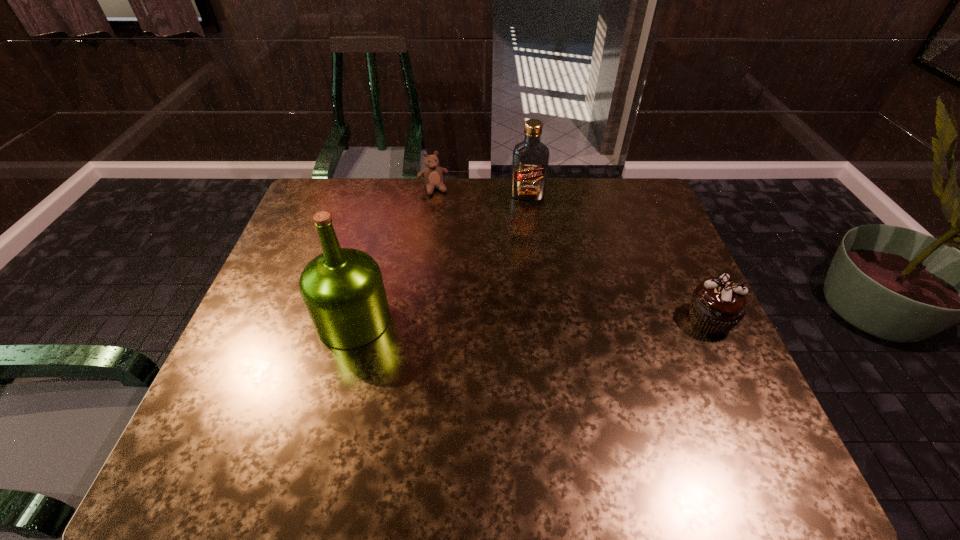
Locate an element on the screen. vacant area between the rightmost object and the tallest object is located at coordinates (532, 320).

This screenshot has width=960, height=540. I want to click on vacant region between the leftmost object and the teddy bear, so click(394, 254).

Find the location of a particular element. vacant area between the olive oil and the vodka is located at coordinates (441, 258).

Locate an element on the screen. This screenshot has width=960, height=540. empty location between the tallest object and the cupcake is located at coordinates (532, 320).

Locate an element on the screen. The image size is (960, 540). free space between the teddy bear and the rightmost object is located at coordinates click(571, 254).

Locate an element on the screen. The width and height of the screenshot is (960, 540). the second closest object to the teddy bear is located at coordinates [x=343, y=291].

In order to click on object that can be found as the second closest to the rightmost object in this screenshot , I will do `click(343, 291)`.

You are a GUI agent. You are given a task and a screenshot of the screen. Output one action in this format:
    pyautogui.click(x=<x>, y=<y>)
    Task: Click on the blank space that satisfies the following two spatial constraints: 1. on the front side of the cupcake; 2. on the left side of the teddy bear
    
    Given the screenshot: What is the action you would take?
    pyautogui.click(x=416, y=320)